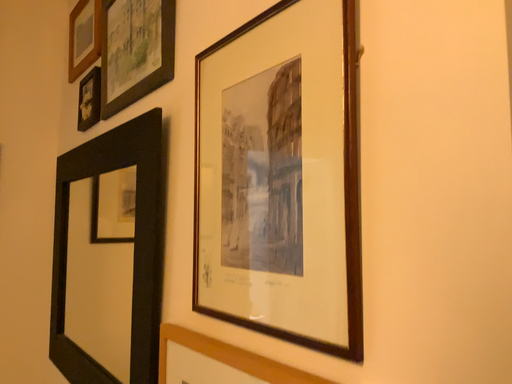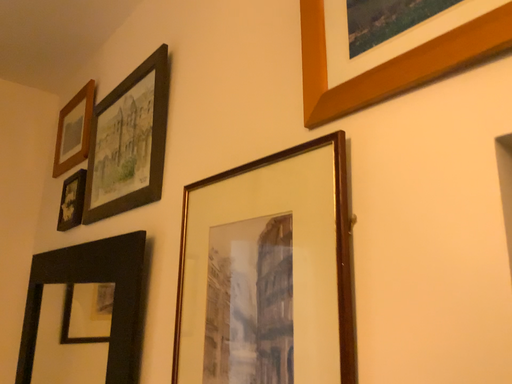
Question: How did the camera likely rotate when shooting the video?

Choices:
 (A) rotated downward
 (B) rotated upward

Answer: (B)